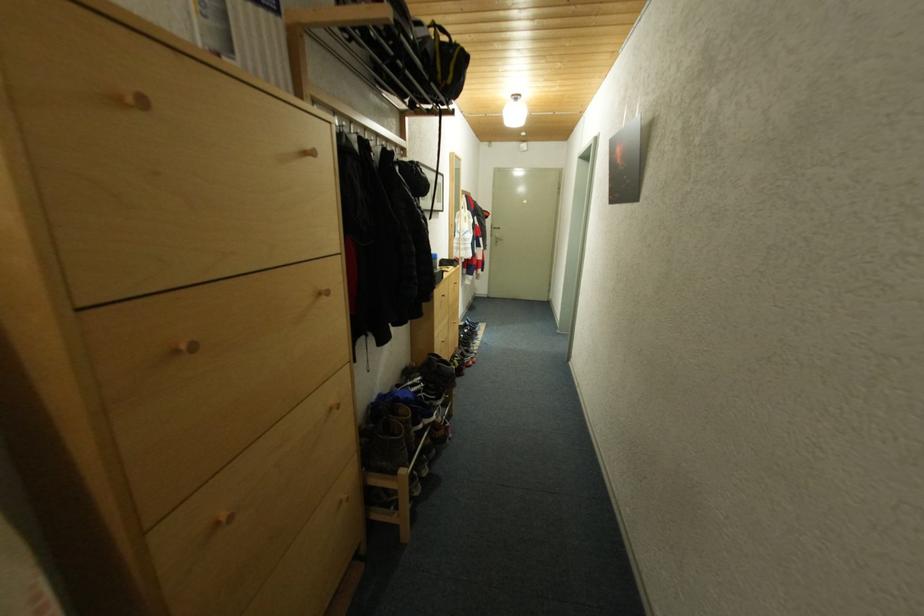
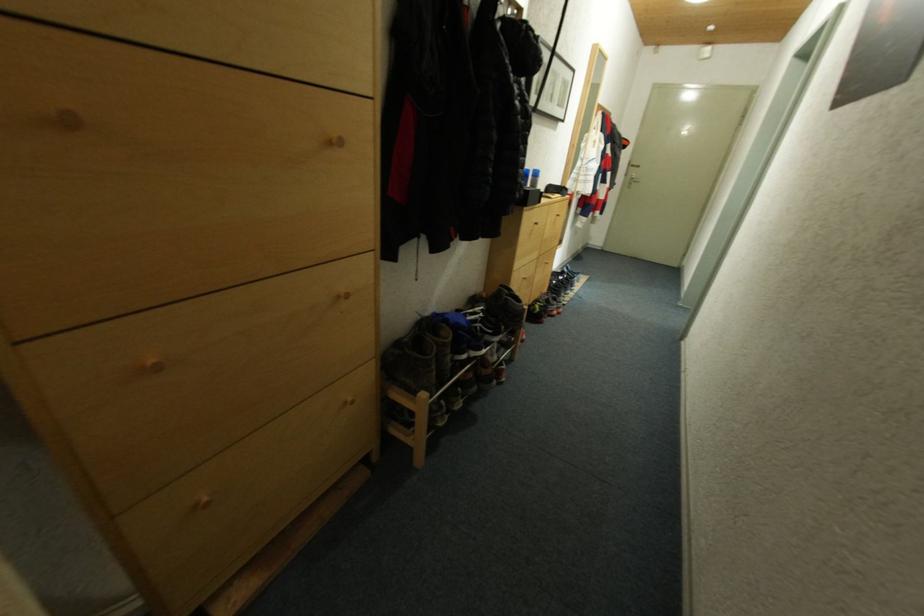
What movement of the cameraman would produce the second image?

The cameraman walked toward right, forward.